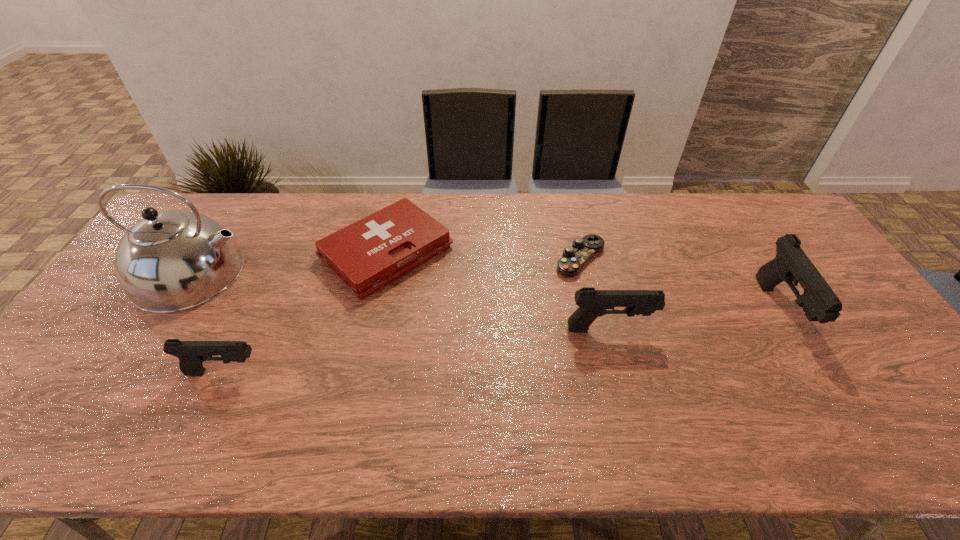
Locate an element on the screen. pistol that stands as the closest to the third tallest object is located at coordinates (791, 264).

Find the location of a particular element. The height and width of the screenshot is (540, 960). free location that satisfies the following two spatial constraints: 1. at the barrel of the rightmost object; 2. at the barrel of the second shortest pistol is located at coordinates (791, 329).

At what (x,y) coordinates should I click in order to perform the action: click on free region that satisfies the following two spatial constraints: 1. on the front side of the control; 2. from the spout of the tallest object. Please return your answer as a coordinate pair (x, y). Looking at the image, I should click on (584, 273).

This screenshot has width=960, height=540. Identify the location of vacant space that satisfies the following two spatial constraints: 1. at the barrel of the rightmost object; 2. at the barrel of the second tallest pistol. (791, 329).